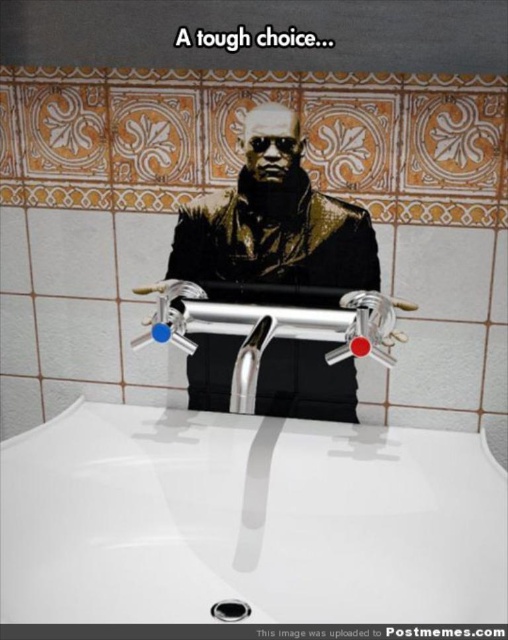
You are standing in the bathroom and want to touch both the white glossy sink at center and the metallic gold jacket at center. Which object will your hand reach first?

The white glossy sink at center is closer to the viewer than the metallic gold jacket at center, so you will reach the white glossy sink at center first.

You are a plumber inspecting a bathroom sink. You see the white glossy sink at center and the black rubber drain at center. Which object is positioned to the left?

The black rubber drain at center is positioned to the left of the white glossy sink at center.

Please look at the image and identify the object located at the coordinates point (x=247, y=520). The scene is a bathroom with a white sink and a person in a black outfit with gold accents behind the faucet. What object is exactly at that point?

The point (x=247, y=520) indicates the white glossy sink at center.